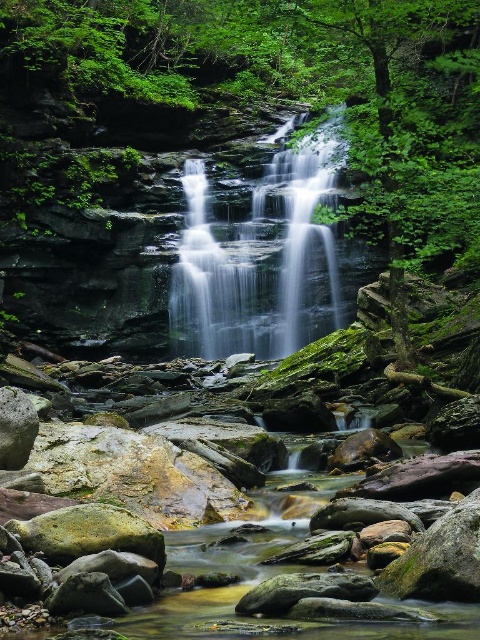
Question: Is green mossy rocks at center smaller than smooth gray water at center?

Choices:
 (A) yes
 (B) no

Answer: (B)

Question: Is green mossy rocks at center above smooth gray water at center?

Choices:
 (A) no
 (B) yes

Answer: (B)

Question: Which object is farther from the camera taking this photo?

Choices:
 (A) smooth gray water at center
 (B) green mossy rocks at center

Answer: (A)

Question: Which point is farther to the camera?

Choices:
 (A) green mossy rocks at center
 (B) smooth gray water at center

Answer: (B)

Question: Is green mossy rocks at center below smooth gray water at center?

Choices:
 (A) yes
 (B) no

Answer: (B)

Question: Which point is farther to the camera?

Choices:
 (A) click(x=328, y=161)
 (B) click(x=350, y=88)

Answer: (A)